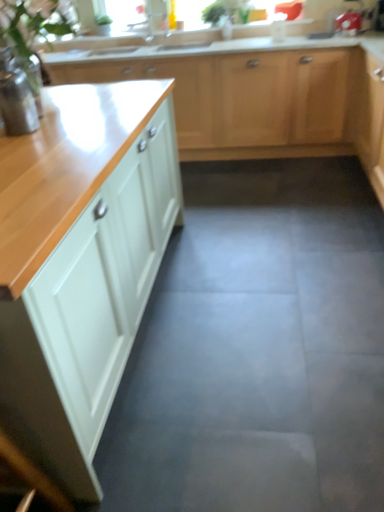
Question: From the image's perspective, relative to matte white cabinets at upper center, which is counted as the first cabinetry, starting from the top, is white glossy cabinet at left, which is the 2th cabinetry from top to bottom, above or below?

Choices:
 (A) below
 (B) above

Answer: (A)

Question: Is point (173, 120) positioned closer to the camera than point (306, 117)?

Choices:
 (A) closer
 (B) farther

Answer: (A)

Question: Based on their relative distances, which object is nearer to the matte white cabinets at upper center, marked as the second cabinetry in a bottom-to-top arrangement?

Choices:
 (A) green leafy plant at upper center
 (B) gray concrete floor at center
 (C) white glossy cabinet at left, which is the 2th cabinetry from top to bottom

Answer: (A)

Question: Based on their relative distances, which object is nearer to the green leafy plant at upper center?

Choices:
 (A) matte white cabinets at upper center, marked as the second cabinetry in a bottom-to-top arrangement
 (B) gray concrete floor at center
 (C) white glossy cabinet at left, arranged as the first cabinetry when ordered from the bottom

Answer: (A)